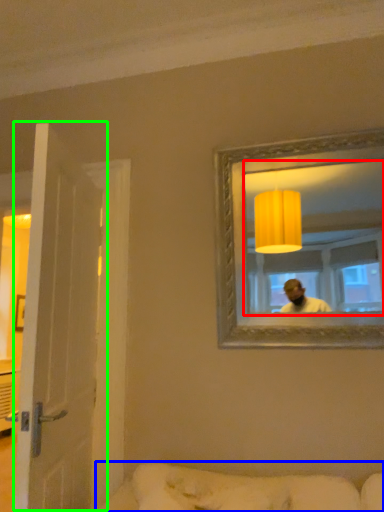
Question: Which object is positioned closest to mirror (highlighted by a red box)? Select from studio couch (highlighted by a blue box) and door (highlighted by a green box).

Choices:
 (A) studio couch
 (B) door

Answer: (A)